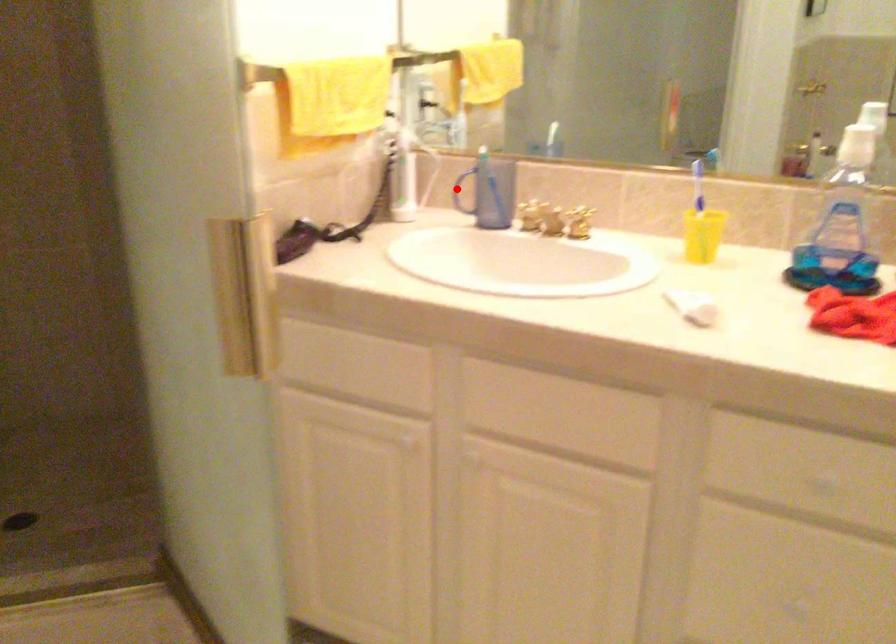
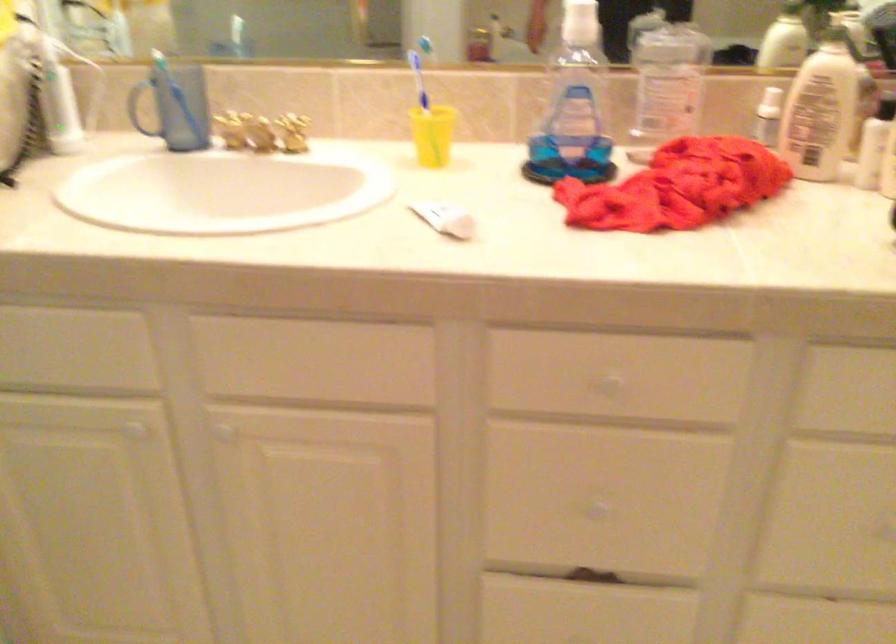
Find the pixel in the second image that matches the highlighted location in the first image.

(140, 106)